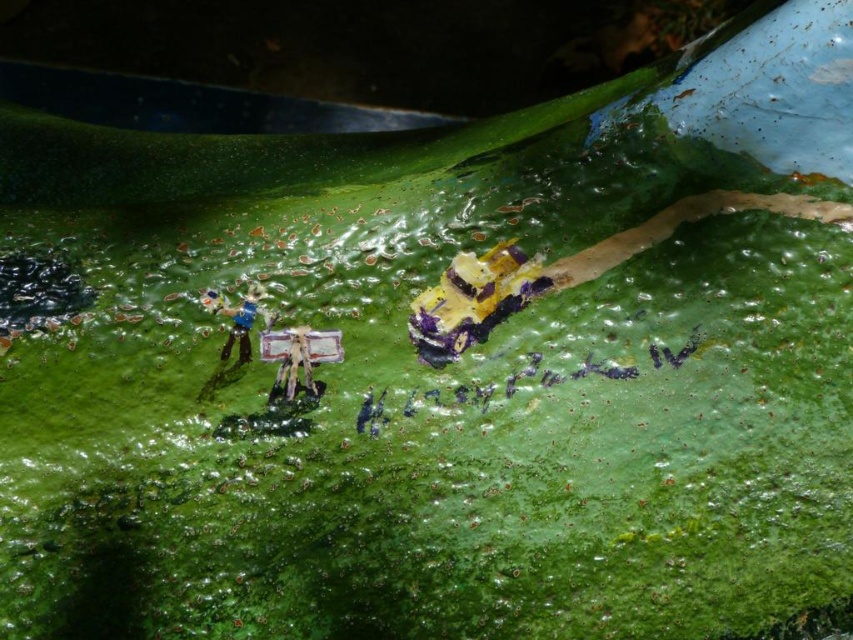
You are a small insect crawling on the textured green leaf. You see the yellow and purple plastic toy at center and the metallic silver figure at center. Which object is closer to you as you move forward?

The yellow and purple plastic toy at center is closer to you because the metallic silver figure at center is behind it.

Based on the photo, you are a tiny explorer on the leaf. You see the metallic silver figure at center and the matte plastic figure at upper left. Which one is closer to the edge of the leaf?

The matte plastic figure at upper left is closer to the edge of the leaf because it is positioned to the left of the metallic silver figure at center, which is on the right side of it.

You are examining a closeup of a leaf with two small figures on it. There are two points marked on the leaf surface. The first point is at coordinate (310,392) and the second is at (244,352). From your perspective, which point is closer to you?

Point (310,392) is closer to the camera than point (244,352).